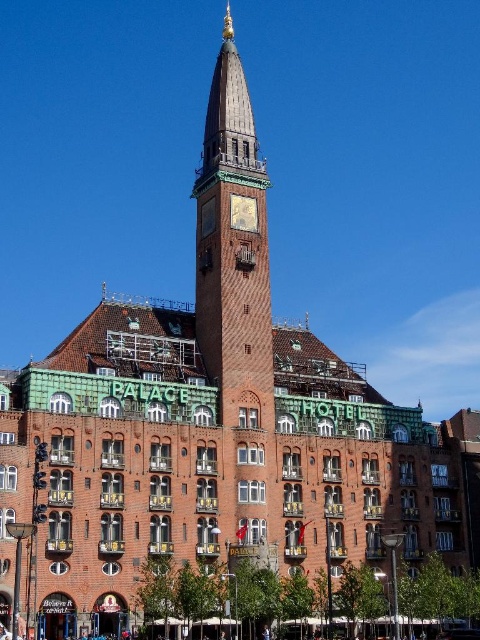
Question: Can you confirm if brown textured clock tower at center is positioned to the left of goldmetallicclock at center?

Choices:
 (A) yes
 (B) no

Answer: (A)

Question: Is brown textured clock tower at center further to camera compared to goldmetallicclock at center?

Choices:
 (A) no
 (B) yes

Answer: (A)

Question: Can you confirm if brown textured clock tower at center is smaller than goldmetallicclock at center?

Choices:
 (A) no
 (B) yes

Answer: (A)

Question: Among these objects, which one is farthest from the camera?

Choices:
 (A) goldmetallicclock at center
 (B) brown textured clock tower at center

Answer: (A)

Question: Which of the following is the farthest from the observer?

Choices:
 (A) goldmetallicclock at center
 (B) brown textured clock tower at center

Answer: (A)